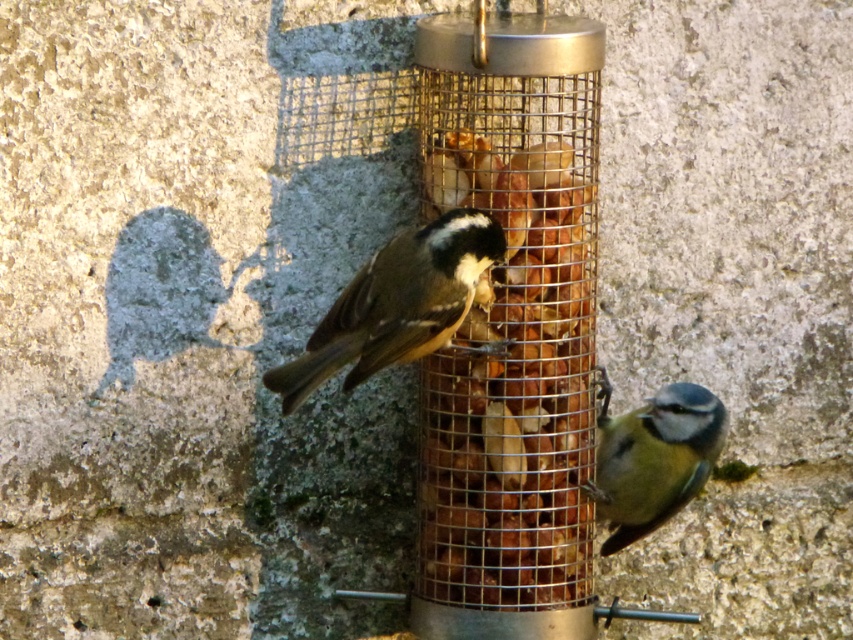
You are a bird with a wingspan of 1 meter. You want to land on the brown textured nuts at center to eat. Can you safely land there without hitting the wall behind?

The brown textured nuts at center is 1.99 meters from the camera, so yes, you can safely land there as the distance is sufficient for your wingspan of 1 meter without hitting the wall.

You are a birdwatcher observing the scene. You notice two birds and some nuts. Which bird is closer to you, the brown matte bird at center or the brown textured nuts at center?

The brown textured nuts at center are closer to you because the brown matte bird at center is behind them.

You are a birdwatcher trying to identify the bird at the specified coordinates in the image. Based on the description provided, what is the species of the bird located at point [396,304]?

The bird at point [396,304] is identified as a brown matte bird at center, which corresponds to the Coal Tit Parus ater.